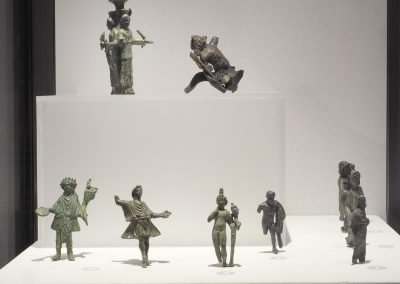
Identify the location of figurines at the top of box. Image resolution: width=400 pixels, height=284 pixels. tap(222, 61).